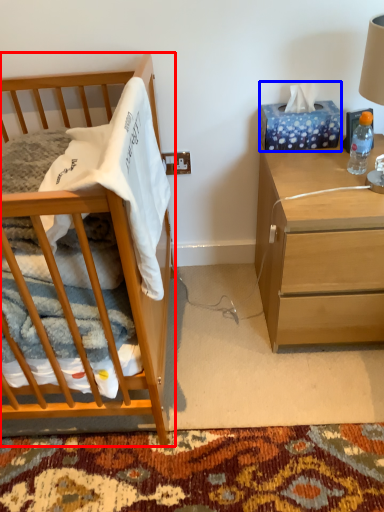
Question: Which of the following is the closest to the observer, cabinetry (highlighted by a red box) or tissue paper (highlighted by a blue box)?

Choices:
 (A) cabinetry
 (B) tissue paper

Answer: (A)